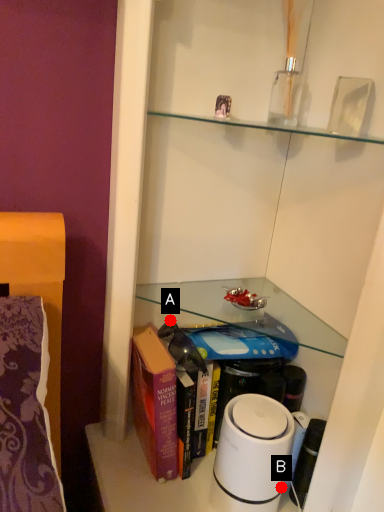
Question: Two points are circled on the image, labeled by A and B beside each circle. Among these points, which one is nearest to the camera?

Choices:
 (A) A is closer
 (B) B is closer

Answer: (B)